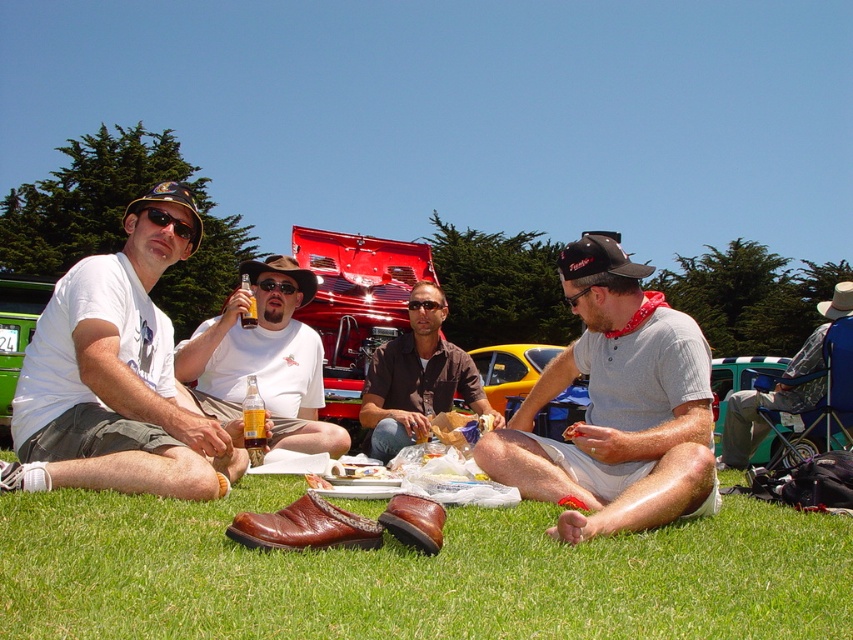
Question: Can you confirm if gray cotton shirt at center is wider than matte white shirt at center?

Choices:
 (A) no
 (B) yes

Answer: (A)

Question: Which object is farther from the camera taking this photo?

Choices:
 (A) white cotton t-shirt at left
 (B) denim jacket at lower right
 (C) brown leather shoes at center
 (D) gray cotton shirt at center

Answer: (B)

Question: Which of these objects is positioned farthest from the denim jacket at lower right?

Choices:
 (A) white cotton t-shirt at left
 (B) green grass at lower center

Answer: (A)

Question: Is white cotton t-shirt at left smaller than matte white shirt at center?

Choices:
 (A) yes
 (B) no

Answer: (B)

Question: Considering the real-world distances, which object is closest to the matte white shirt at center?

Choices:
 (A) brown leather shoes at center
 (B) denim jacket at lower right
 (C) gray cotton shirt at center

Answer: (A)

Question: Is matte white shirt at center below denim jacket at lower right?

Choices:
 (A) no
 (B) yes

Answer: (B)